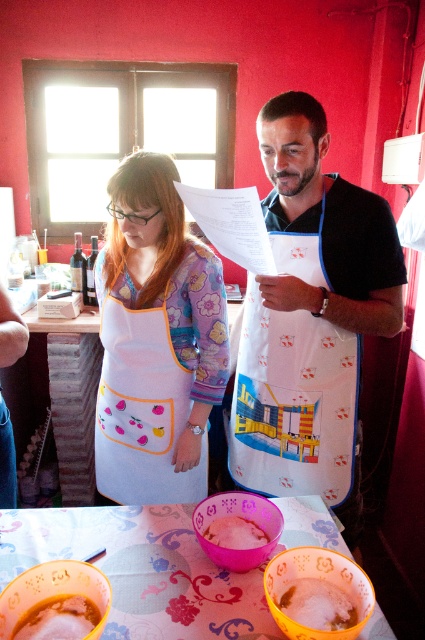
You are a photographer standing in the kitchen scene. You want to take a photo that includes both the point at coordinates point [170,240] and point [209,534]. Which point should you focus on first to ensure both are in focus?

You should focus on point [170,240] first because it is closer to the camera than point [209,534]. This way, both points will be within the depth of field.

You are a chef preparing to wear your white fabric apron with colorful design at center and place the pink matte plastic bowl at center on the table. Based on their sizes, can you determine if the apron will fit on the table without overlapping the bowl?

The white fabric apron with colorful design at center is wider than the pink matte plastic bowl at center. Since the apron is larger in width, it might overlap the bowl if placed carelessly, so you should arrange them carefully to avoid overlapping.